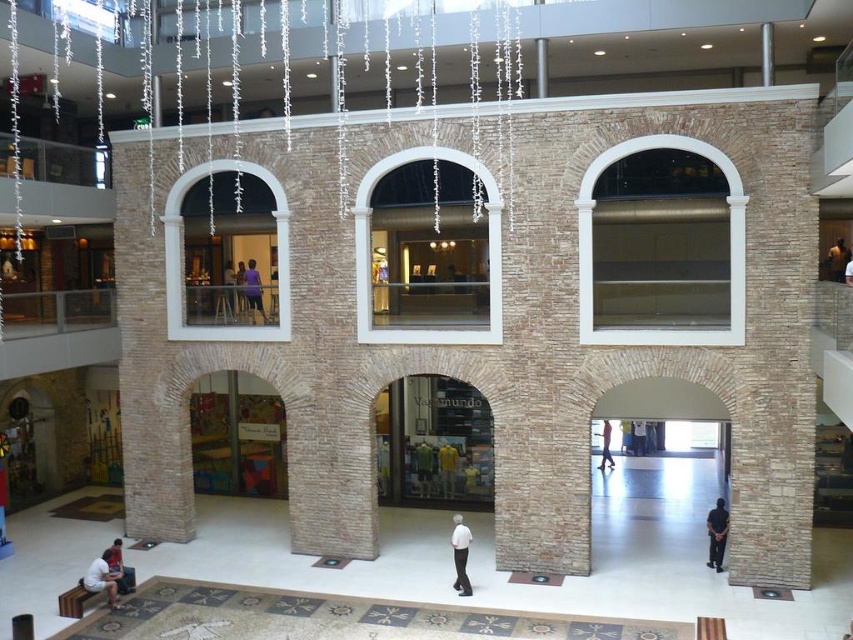
What is the spatial relationship between the white matte shirt at center and the light brown leather jacket at center in the mall interior?

The white matte shirt at center is positioned to the left of the light brown leather jacket at center.

You are a customer in the mall looking at the white matte shirt at center and the light brown leather jacket at center. Which item is closer to the floor?

The white matte shirt at center is closer to the floor because it is positioned under the light brown leather jacket at center.